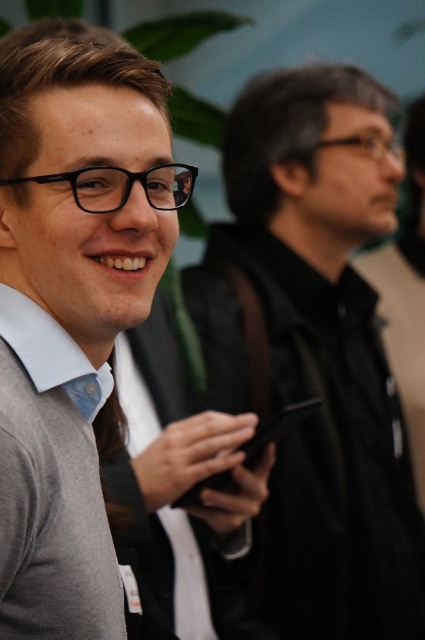
You are organizing a charity clothing drive and need to determine which items can fit into a donation box that has a maximum capacity for large clothing items. Based on the scene, which object between the black matte jacket at center and the gray sweater at left is more likely to require a larger donation box?

The black matte jacket at center is bigger than the gray sweater at left, so it would require a larger donation box.

You are standing in a crowded room and want to take a photo of the black matte jacket at center and the gray sweater at left. Which object should you focus on first to ensure both are in focus?

The black matte jacket at center is further to the viewer than the gray sweater at left. To ensure both are in focus, you should focus on the black matte jacket at center first since it is closer to you.